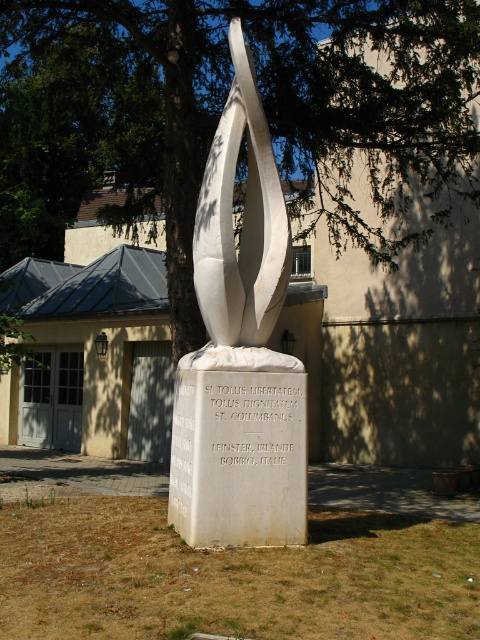
What is located at the point with coordinates (220, 108)?

The green leafy tree at center is located at point (220, 108).

From the picture: You are a park visitor who wants to take a photo of the sculpture without any obstructions. You are standing at point 0.200, 0.500. Is the green leafy tree at center blocking your view of the sculpture?

The green leafy tree at center is located at point (220, 108). Since you are standing at (240, 128), which is slightly to the right and above the tree, the tree may be blocking your view of the sculpture depending on the tree canopy spread. However, the exact obstruction isn

In the scene shown: You are an artist planning to paint a landscape that includes both the green leafy tree at center and the white polished stone sculpture at center. You want to ensure the tree and sculpture are proportionally accurate. Which object should you paint wider to maintain the correct proportions?

The green leafy tree at center is wider than the white polished stone sculpture at center, so you should paint the green leafy tree at center wider than the white polished stone sculpture at center to maintain correct proportions.